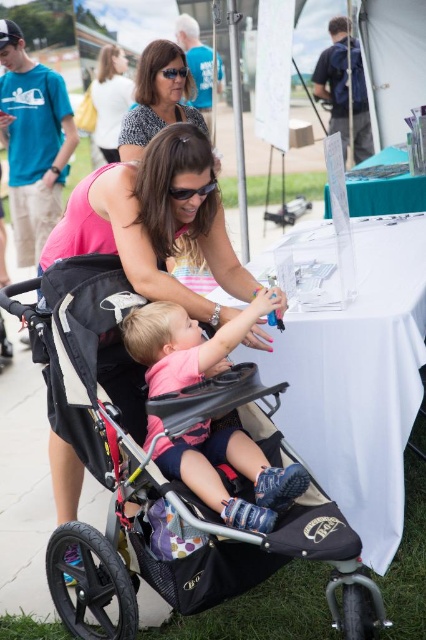
You are standing at the camera position and want to pick up an object. There are two points marked in the image, point 1 at coordinates point (x=233, y=317) and point 2 at coordinates point (x=123, y=56). Which point is closer to you?

Point (x=233, y=317) is closer to the camera than point (x=123, y=56).

You are a photographer trying to capture a candid shot of the black fabric stroller at center and the pink fabric at center. Which object should you focus on first to ensure it appears sharp in the photo?

The black fabric stroller at center is closer to the viewer than the pink fabric at center, so you should focus on the black fabric stroller at center first to ensure it appears sharp.